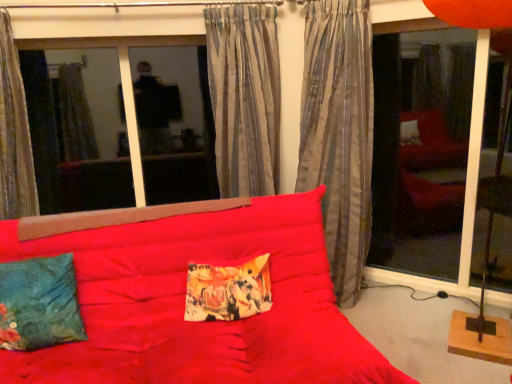
Question: Can you confirm if striped fabric curtain at center, which is counted as the 2th curtain, starting from the left, is positioned to the right of striped fabric curtain at left, the 1th curtain when ordered from left to right?

Choices:
 (A) no
 (B) yes

Answer: (B)

Question: Is the depth of striped fabric curtain at center, the second curtain from the right, greater than that of striped fabric curtain at left, the 1th curtain when ordered from left to right?

Choices:
 (A) yes
 (B) no

Answer: (A)

Question: Could striped fabric curtain at left, which appears as the 3th curtain when viewed from the right, be considered to be inside striped fabric curtain at center, the second curtain from the right?

Choices:
 (A) yes
 (B) no

Answer: (B)

Question: Is striped fabric curtain at center, which is counted as the 2th curtain, starting from the left, wider than striped fabric curtain at left, the 1th curtain when ordered from left to right?

Choices:
 (A) no
 (B) yes

Answer: (A)

Question: Is striped fabric curtain at center, which is counted as the 2th curtain, starting from the left, not within striped fabric curtain at left, the 1th curtain when ordered from left to right?

Choices:
 (A) yes
 (B) no

Answer: (A)

Question: In terms of height, does silky gray curtain at center, positioned as the 3th curtain in left-to-right order, look taller or shorter compared to transparent glass window at upper left?

Choices:
 (A) short
 (B) tall

Answer: (B)

Question: From the image's perspective, is silky gray curtain at center, positioned as the 3th curtain in left-to-right order, located above or below transparent glass window at upper left?

Choices:
 (A) below
 (B) above

Answer: (A)

Question: From a real-world perspective, relative to transparent glass window at upper left, is silky gray curtain at center, positioned as the first curtain in right-to-left order, vertically above or below?

Choices:
 (A) above
 (B) below

Answer: (B)

Question: Is silky gray curtain at center, positioned as the first curtain in right-to-left order, inside or outside of transparent glass window at upper left?

Choices:
 (A) outside
 (B) inside

Answer: (A)

Question: From a real-world perspective, is transparent glass door at right positioned above or below striped fabric curtain at left, the 1th curtain when ordered from left to right?

Choices:
 (A) above
 (B) below

Answer: (B)

Question: Would you say transparent glass door at right is to the left or to the right of striped fabric curtain at left, the 1th curtain when ordered from left to right, in the picture?

Choices:
 (A) left
 (B) right

Answer: (B)

Question: Relative to striped fabric curtain at left, which appears as the 3th curtain when viewed from the right, is transparent glass door at right in front or behind?

Choices:
 (A) behind
 (B) front

Answer: (A)

Question: Is transparent glass door at right inside or outside of striped fabric curtain at left, the 1th curtain when ordered from left to right?

Choices:
 (A) inside
 (B) outside

Answer: (B)

Question: In terms of height, does silky gray curtain at center, positioned as the first curtain in right-to-left order, look taller or shorter compared to velvety teal pillow at lower left, which appears as the first pillow when viewed from the left?

Choices:
 (A) tall
 (B) short

Answer: (A)

Question: From a real-world perspective, is silky gray curtain at center, positioned as the first curtain in right-to-left order, positioned above or below velvety teal pillow at lower left, which appears as the first pillow when viewed from the left?

Choices:
 (A) above
 (B) below

Answer: (A)